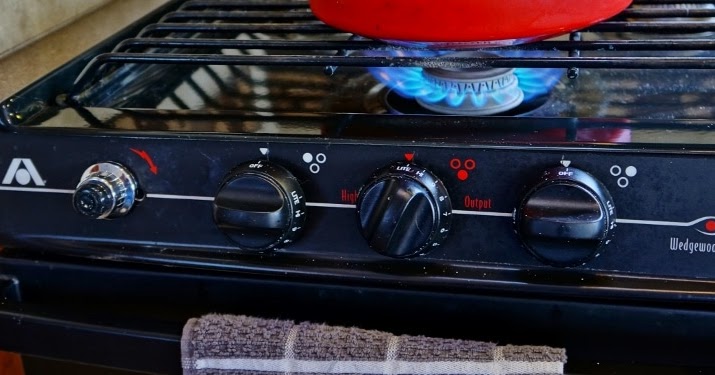
Find the location of a particular element. brown terrycloth dishtowel is located at coordinates click(x=257, y=338).